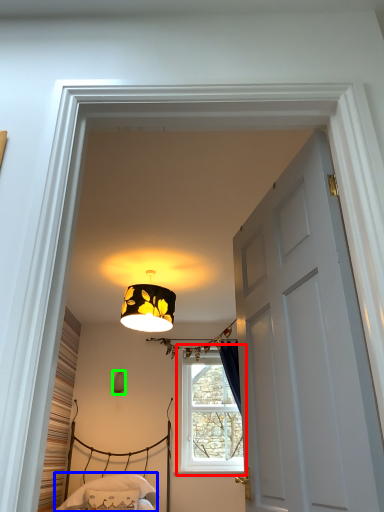
Question: Estimate the real-world distances between objects in this image. Which object is closer to window (highlighted by a red box), bedding (highlighted by a blue box) or lamp (highlighted by a green box)?

Choices:
 (A) bedding
 (B) lamp

Answer: (A)